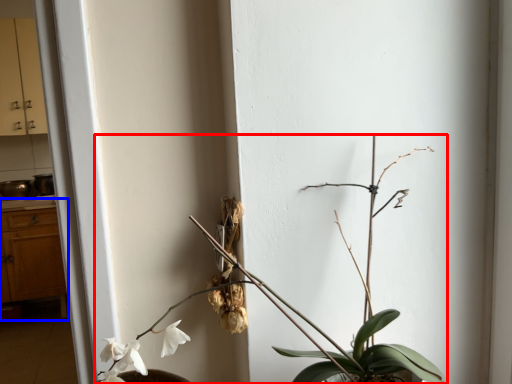
Question: Which of the following is the closest to the observer, houseplant (highlighted by a red box) or dresser (highlighted by a blue box)?

Choices:
 (A) houseplant
 (B) dresser

Answer: (A)